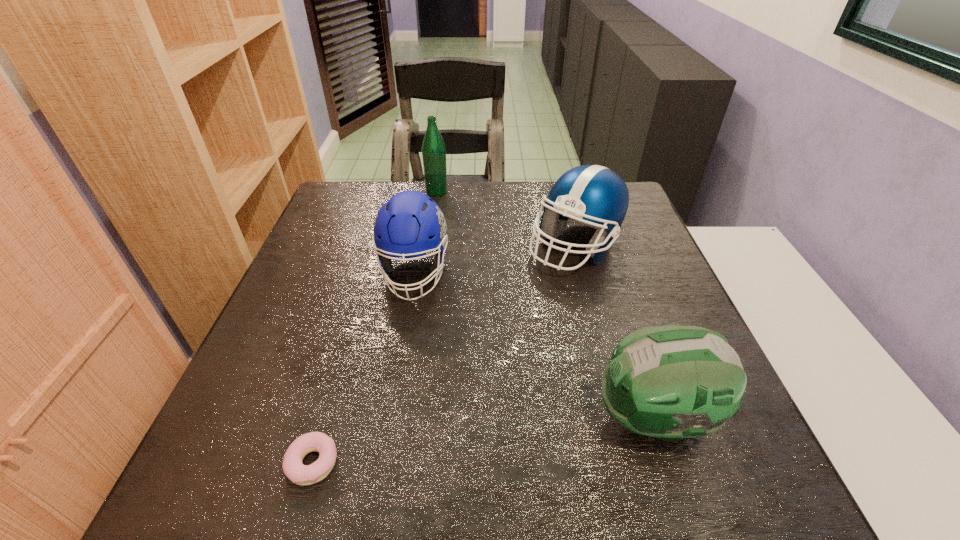
This screenshot has width=960, height=540. I want to click on blank space at the left edge of the desktop, so click(x=260, y=369).

Locate an element on the screen. This screenshot has width=960, height=540. vacant space at the right edge of the desktop is located at coordinates (627, 285).

In order to click on vacant space that is in between the leftmost football helmet and the shortest object in this screenshot , I will do `click(364, 368)`.

Locate an element on the screen. The image size is (960, 540). vacant space in between the nearest football helmet and the farthest object is located at coordinates (545, 305).

The width and height of the screenshot is (960, 540). I want to click on empty space between the doughnut and the leftmost football helmet, so click(x=364, y=368).

Locate an element on the screen. vacant area between the doughnut and the nearest football helmet is located at coordinates (483, 441).

Identify the location of vacant area between the bottle and the nearest football helmet. (545, 305).

Point out which object is positioned as the fourth nearest to the nearest football helmet. Please provide its 2D coordinates. Your answer should be formatted as a tuple, i.e. [(x, y)], where the tuple contains the x and y coordinates of a point satisfying the conditions above.

[(433, 147)]

The height and width of the screenshot is (540, 960). In order to click on the closest object relative to the farthest object in this screenshot , I will do `click(410, 224)`.

Select which football helmet is the second closest to the doughnut. Please provide its 2D coordinates. Your answer should be formatted as a tuple, i.e. [(x, y)], where the tuple contains the x and y coordinates of a point satisfying the conditions above.

[(671, 382)]